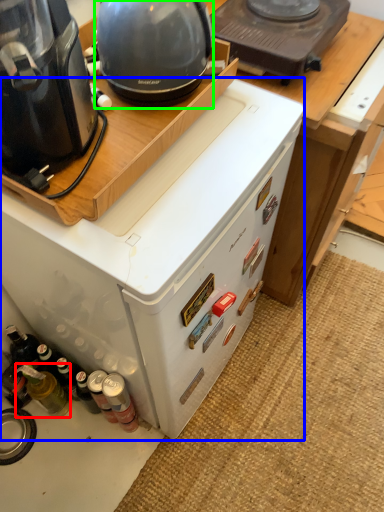
Question: Which is farther away from bottle (highlighted by a red box)? home appliance (highlighted by a blue box) or appliance (highlighted by a green box)?

Choices:
 (A) home appliance
 (B) appliance

Answer: (B)